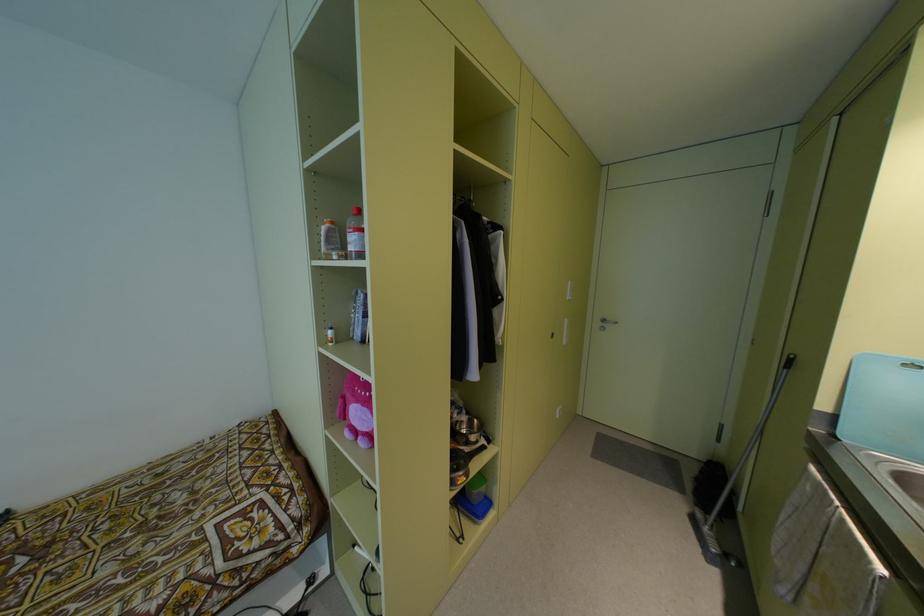
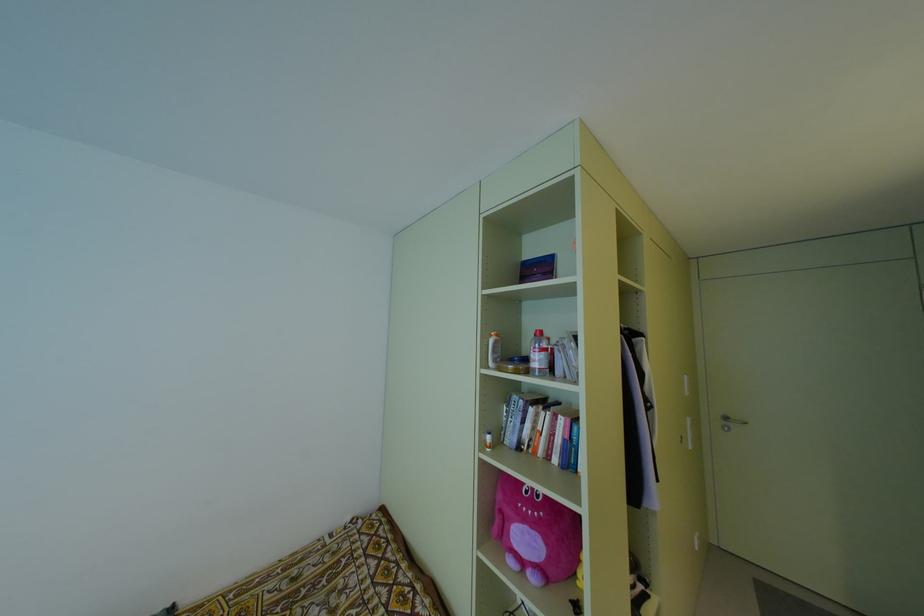
Question: The images are taken continuously from a first-person perspective. In which direction are you moving?

Choices:
 (A) Left
 (B) Right
 (C) Forward
 (D) Backward

Answer: (A)